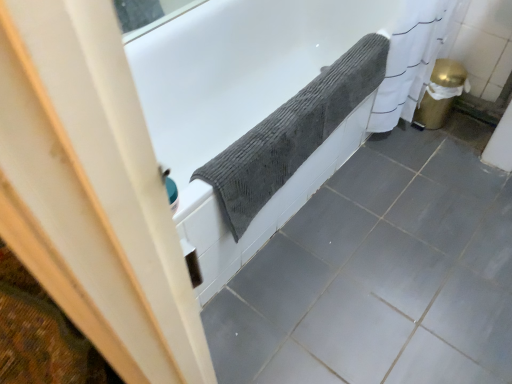
Image resolution: width=512 pixels, height=384 pixels. Find the location of `unoccupied area behind gray matte ceramic tile at lower center, positioned as the 1th ceramic tile in top-to-bottom order`. unoccupied area behind gray matte ceramic tile at lower center, positioned as the 1th ceramic tile in top-to-bottom order is located at coordinates (470, 176).